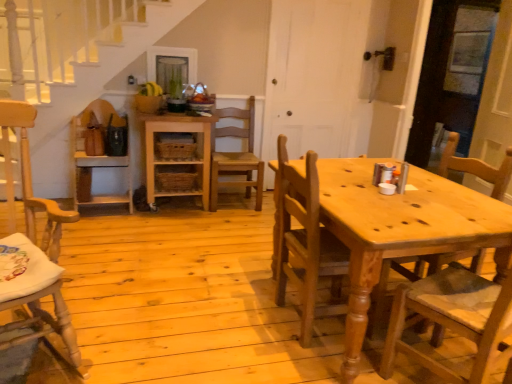
This screenshot has height=384, width=512. In order to click on vacant space positioned to the left of natural wood chair at center, which appears as the second chair when viewed from the right in this screenshot , I will do `click(239, 318)`.